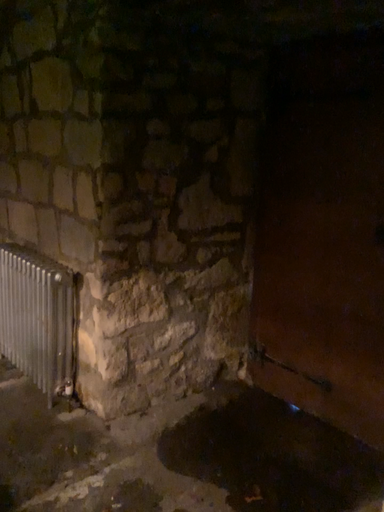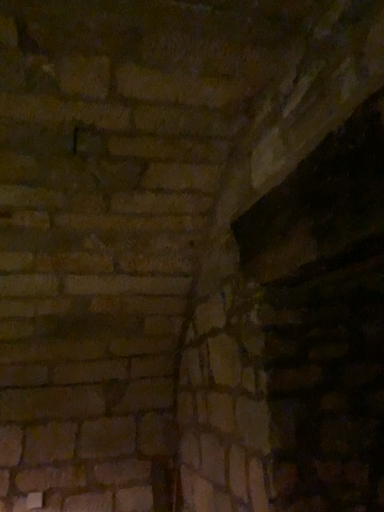
Question: How did the camera likely rotate when shooting the video?

Choices:
 (A) rotated downward
 (B) rotated upward

Answer: (B)